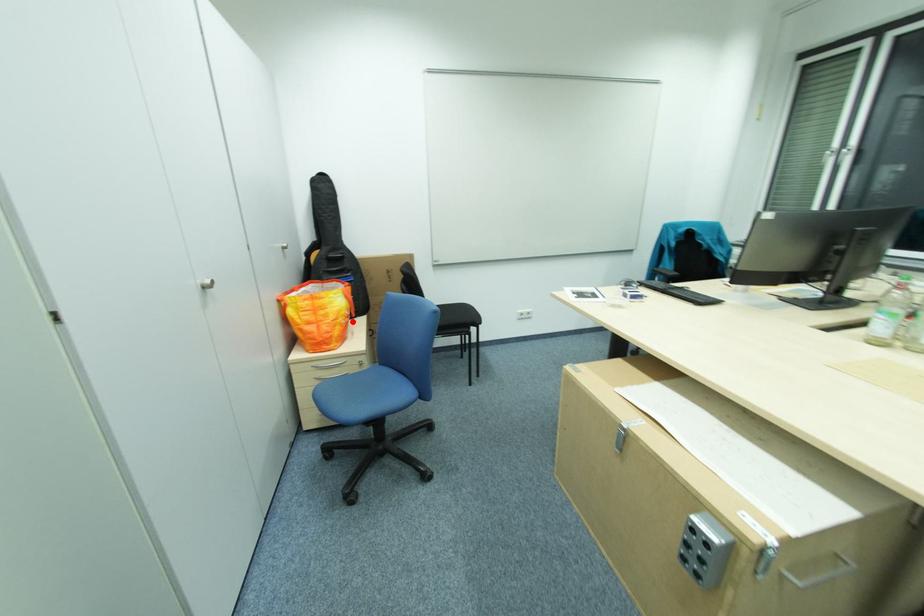
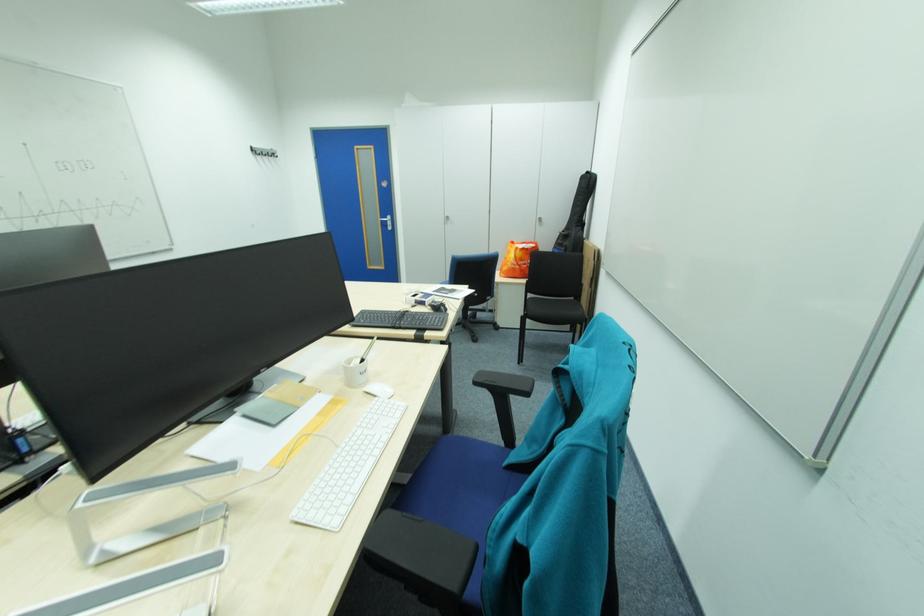
In the second image, find the point that corresponds to the highlighted location in the first image.

(517, 265)